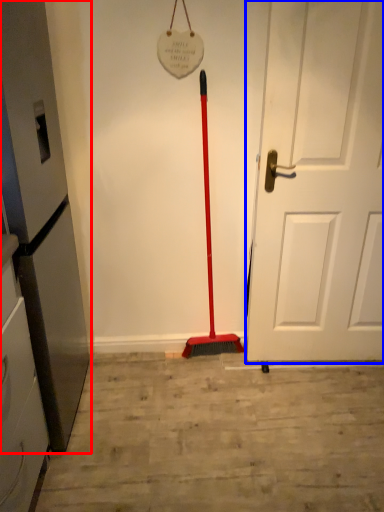
Question: Among these objects, which one is nearest to the camera, appliance (highlighted by a red box) or door (highlighted by a blue box)?

Choices:
 (A) appliance
 (B) door

Answer: (A)